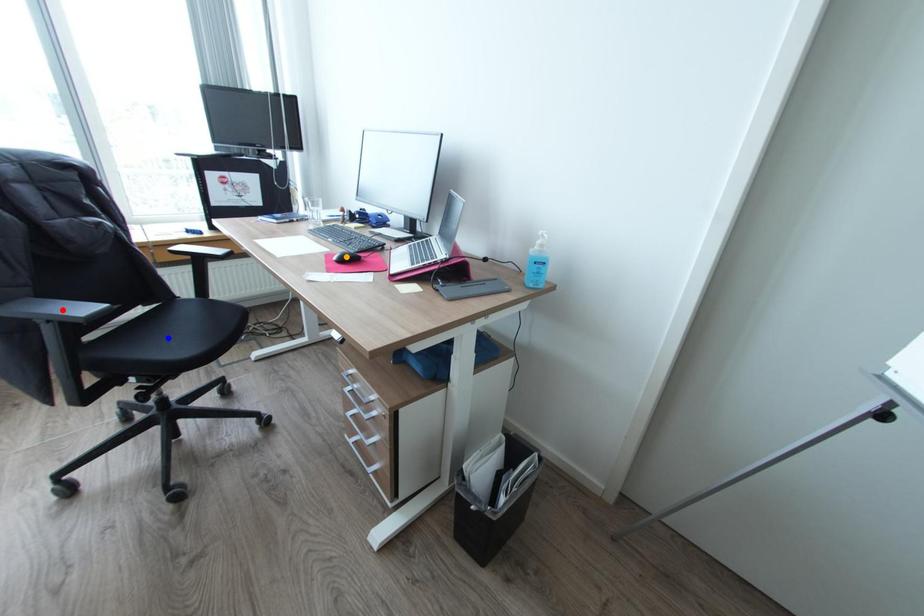
Order these from nearest to farthest:
- blue point
- orange point
- red point

red point
orange point
blue point